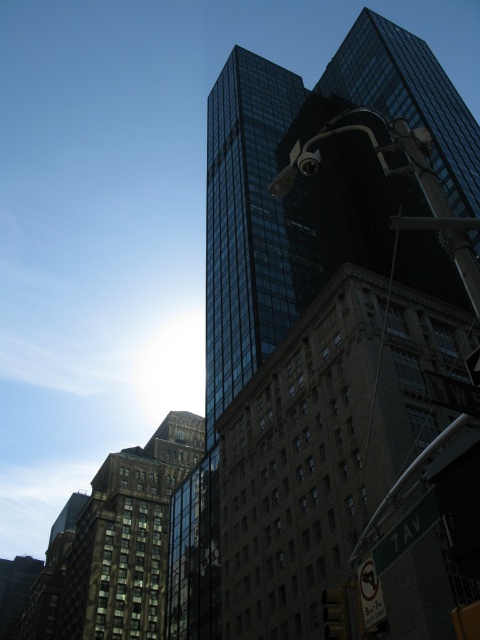
You are standing on the sidewalk in front of the shiny glass skyscraper at center. You want to take a photo of it without any obstructions. Is there enough space between you and the skyscraper to step back and get a full view?

The shiny glass skyscraper at center is 24.82 meters away from the viewer. Since this distance provides ample space, stepping back slightly should allow you to capture the entire building in your photo without obstructions.

You are a delivery driver approaching the intersection at 7 Av. You see the brown brick building at center and the green matte street sign at lower right. According to the scene, which object is closer to the left side of the road?

The brown brick building at center is to the left of the green matte street sign at lower right, so it is closer to the left side of the road.